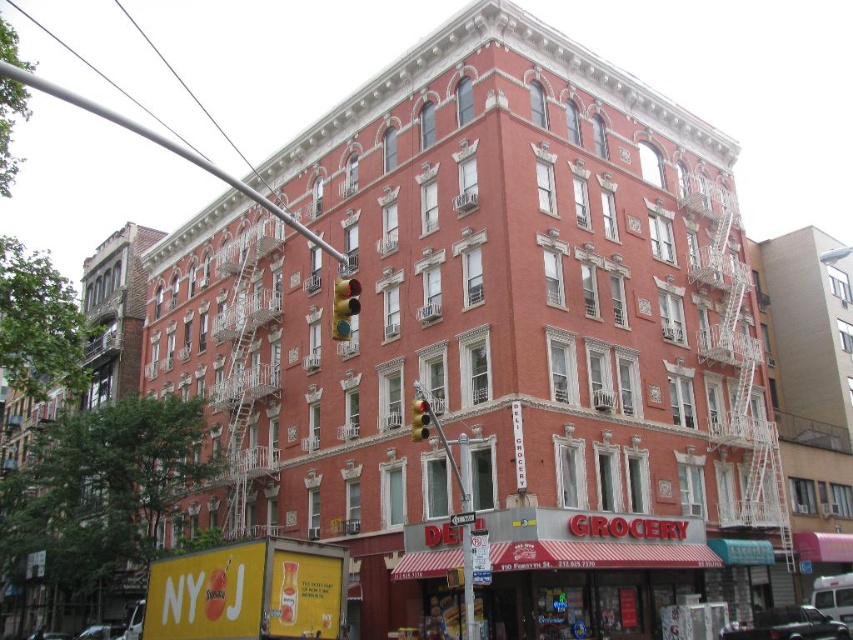
Can you confirm if metallic yellow traffic light at center is smaller than yellow matte traffic light at center?

No.

Where is `metallic yellow traffic light at center`? metallic yellow traffic light at center is located at coordinates (344, 307).

Which is in front, point (352, 280) or point (410, 432)?

Point (352, 280) is more forward.

Identify the location of metallic yellow traffic light at center. (344, 307).

How much distance is there between metallic silver pole at upper left and metallic yellow traffic light at center?

metallic silver pole at upper left is 254.65 feet from metallic yellow traffic light at center.

Is metallic silver pole at upper left taller than metallic yellow traffic light at center?

Yes, metallic silver pole at upper left is taller than metallic yellow traffic light at center.

Between point (206, 163) and point (358, 310), which one is positioned behind?

Positioned behind is point (206, 163).

Identify the location of metallic silver pole at upper left. (166, 148).

Is metallic silver pole at upper left thinner than yellow matte traffic light at center?

Incorrect, metallic silver pole at upper left's width is not less than yellow matte traffic light at center's.

From the picture: Which is below, metallic silver pole at upper left or yellow matte traffic light at center?

Positioned lower is yellow matte traffic light at center.

Does point (39, 80) come behind point (415, 401)?

Yes, it is behind point (415, 401).

Locate an element on the screen. metallic silver pole at upper left is located at coordinates (166, 148).